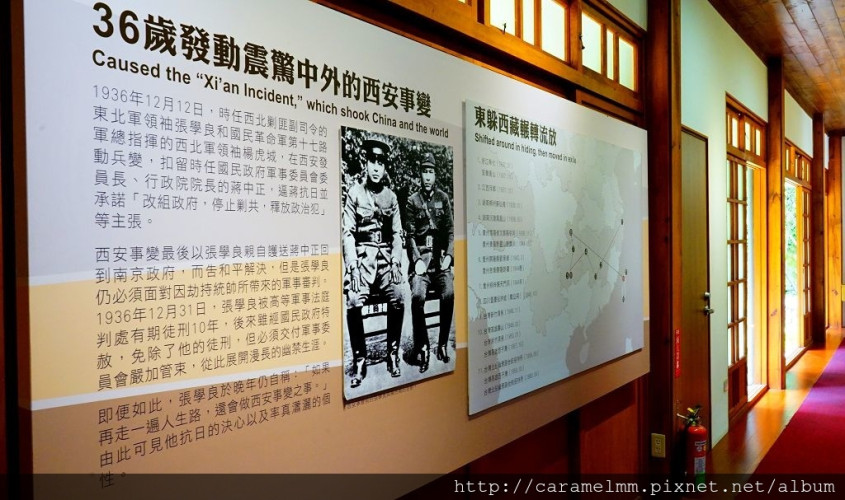
At what (x,y) coordinates should I click in order to perform the action: click on windows. Please return your answer as a coordinate pair (x, y). This screenshot has height=500, width=845. Looking at the image, I should click on (504, 26), (565, 26), (592, 56), (742, 141), (796, 163).